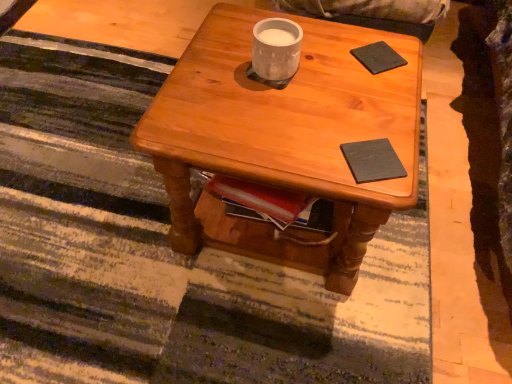
Question: Is wooden coffee table at center turned away from dark matte book at center, the second pad from the top?

Choices:
 (A) yes
 (B) no

Answer: (B)

Question: Does wooden coffee table at center touch dark matte book at center, the 1th pad positioned from the bottom?

Choices:
 (A) no
 (B) yes

Answer: (A)

Question: Is wooden coffee table at center to the right of dark matte book at center, which is the first pad from front to back, from the viewer's perspective?

Choices:
 (A) yes
 (B) no

Answer: (B)

Question: From a real-world perspective, is wooden coffee table at center positioned under dark matte book at center, the 1th pad positioned from the bottom, based on gravity?

Choices:
 (A) yes
 (B) no

Answer: (A)

Question: Is wooden coffee table at center shorter than dark matte book at center, which is the first pad from front to back?

Choices:
 (A) yes
 (B) no

Answer: (B)

Question: Based on their sizes in the image, would you say wooden coffee table at center is bigger or smaller than black matte pad at upper right, the second pad in the front-to-back sequence?

Choices:
 (A) big
 (B) small

Answer: (A)

Question: In terms of height, does wooden coffee table at center look taller or shorter compared to black matte pad at upper right, which is the first pad in top-to-bottom order?

Choices:
 (A) tall
 (B) short

Answer: (A)

Question: From the image's perspective, is wooden coffee table at center located above or below black matte pad at upper right, which is the first pad in top-to-bottom order?

Choices:
 (A) below
 (B) above

Answer: (A)

Question: Is wooden coffee table at center spatially inside black matte pad at upper right, the second pad in the front-to-back sequence, or outside of it?

Choices:
 (A) outside
 (B) inside

Answer: (A)

Question: Considering the positions of point (364, 46) and point (293, 33), is point (364, 46) closer or farther from the camera than point (293, 33)?

Choices:
 (A) farther
 (B) closer

Answer: (A)

Question: Is black matte pad at upper right, which is the first pad in top-to-bottom order, in front of or behind white matte cup at center in the image?

Choices:
 (A) behind
 (B) front

Answer: (A)

Question: Which is correct: black matte pad at upper right, the second pad in the front-to-back sequence, is inside white matte cup at center, or outside of it?

Choices:
 (A) outside
 (B) inside

Answer: (A)

Question: From the image's perspective, relative to white matte cup at center, is black matte pad at upper right, the second pad in the front-to-back sequence, above or below?

Choices:
 (A) above
 (B) below

Answer: (A)

Question: From a real-world perspective, is dark matte book at center, positioned as the second pad in back-to-front order, positioned above or below black matte pad at upper right, the second pad in the front-to-back sequence?

Choices:
 (A) below
 (B) above

Answer: (A)

Question: Is dark matte book at center, which is the first pad from front to back, in front of or behind black matte pad at upper right, the first pad viewed from the back, in the image?

Choices:
 (A) front
 (B) behind

Answer: (A)